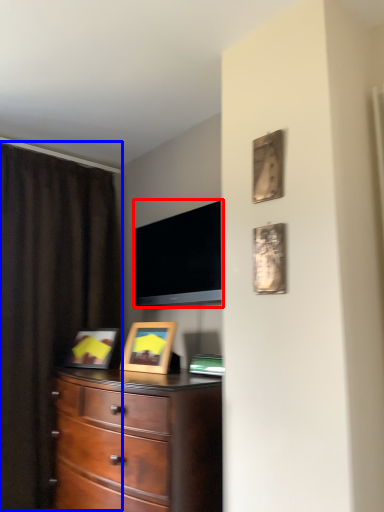
Question: Which of the following is the closest to the observer, television (highlighted by a red box) or curtain (highlighted by a blue box)?

Choices:
 (A) television
 (B) curtain

Answer: (B)